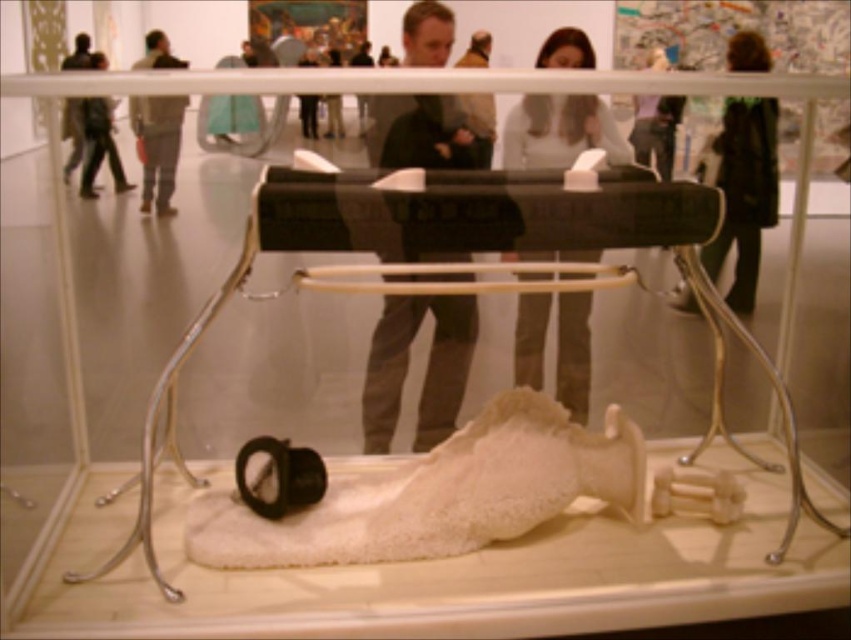
Consider the image. You are an art curator planning to place both jackets in a display case. The display case has a width of 1.2 meters. If you want to place the dark brown leather jacket at upper right and the gray fabric jacket at upper left side by side, will they fit without overlapping?

The dark brown leather jacket at upper right is wider than the gray fabric jacket at upper left. However, since their combined widths are not specified, we cannot determine if they will fit in the 1.2 meter display case without more information about each jacket s individual width.

You are an art curator arranging a display. You have two jackets to place in the gallery. The jackets are the dark gray fabric jacket at center and the dark brown leather jacket at upper right. According to the current arrangement, which jacket is located to the left of the other?

The dark gray fabric jacket at center is positioned on the left side of dark brown leather jacket at upper right, so the dark gray fabric jacket at center is to the left of the dark brown leather jacket at upper right.

You are an art curator standing in front of the transparent display case. You notice two points marked on the glass. The first point is at coordinate point (768, 209) and the second is at point (153, 97). If you want to draw a line connecting these two points on the glass, which point should you start drawing from to ensure the line is visible over the black object inside the display case?

You should start drawing from point (153, 97) and move towards point (768, 209). This is because point (768, 209) is behind point (153, 97) relative to the observer, so starting at the closer point ensures the line remains visible over the black object.